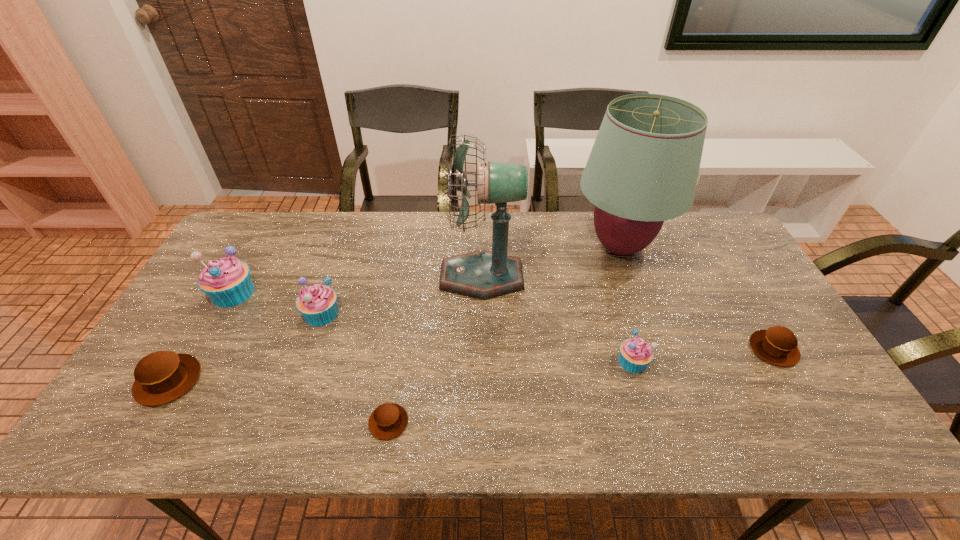
Where is `vacant area situated 0.180m on the back of the smallest blue muffin`? vacant area situated 0.180m on the back of the smallest blue muffin is located at coordinates (614, 299).

This screenshot has height=540, width=960. Identify the location of vacant area located on the back of the leftmost brown muffin. (196, 334).

This screenshot has width=960, height=540. In order to click on vacant region located on the left of the rightmost muffin in this screenshot , I will do `click(721, 349)`.

Find the location of `vacant point located on the right of the shortest muffin`. vacant point located on the right of the shortest muffin is located at coordinates (539, 422).

The image size is (960, 540). I want to click on lampshade that is at the far edge, so click(x=643, y=168).

Where is `fan that is at the far edge`? fan that is at the far edge is located at coordinates (483, 275).

Identify the location of object present at the near edge. [389, 420].

The image size is (960, 540). I want to click on object present at the right edge, so click(777, 345).

Where is `vacant space at the far edge of the desktop`? This screenshot has height=540, width=960. vacant space at the far edge of the desktop is located at coordinates (444, 256).

You are a GUI agent. You are given a task and a screenshot of the screen. Output one action in this format:
    pyautogui.click(x=<x>, y=<y>)
    Task: Click on the vacant region at the near edge of the desktop
    The image size is (960, 540).
    Given the screenshot: What is the action you would take?
    pyautogui.click(x=598, y=421)